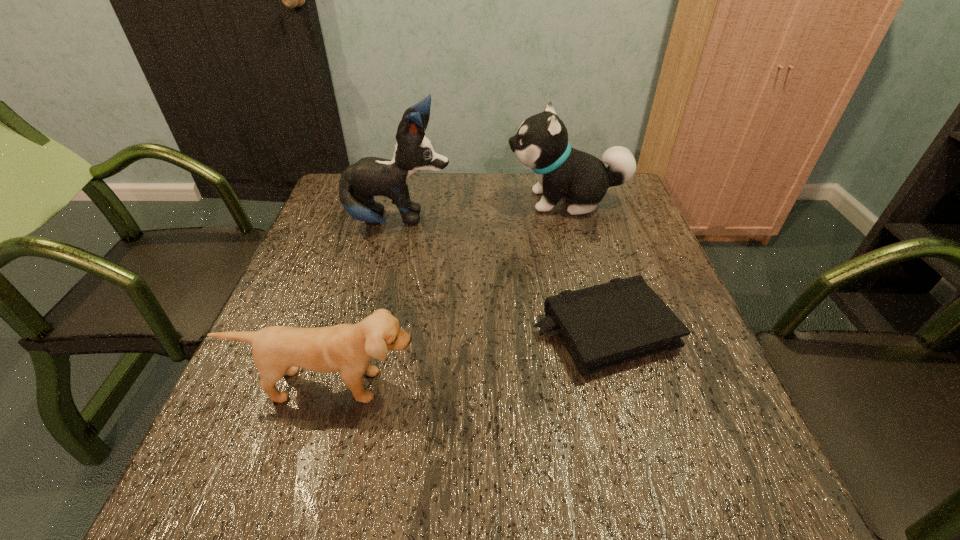
This screenshot has width=960, height=540. What are the coordinates of `the tallest object` in the screenshot? It's located at (370, 176).

Find the location of a particular element. The width and height of the screenshot is (960, 540). the second tallest puppy is located at coordinates (541, 143).

Identify the location of the third shortest object. Image resolution: width=960 pixels, height=540 pixels. (541, 143).

I want to click on the third tallest object, so click(x=346, y=348).

Locate an element on the screen. the nearest puppy is located at coordinates (346, 348).

Identify the location of the shortest object. (602, 326).

Where is `free space located on the front-facing side of the tallest object`? The image size is (960, 540). free space located on the front-facing side of the tallest object is located at coordinates (495, 221).

At what (x,y) coordinates should I click in order to perform the action: click on vacant point located 0.330m at the face of the second tallest puppy. Please return your answer as a coordinate pair (x, y). The height and width of the screenshot is (540, 960). Looking at the image, I should click on (394, 201).

The height and width of the screenshot is (540, 960). Identify the location of vacant space located at the face of the second tallest puppy. click(475, 201).

The height and width of the screenshot is (540, 960). In order to click on vacant space located 0.060m at the face of the second tallest puppy in this screenshot , I will do `click(486, 201)`.